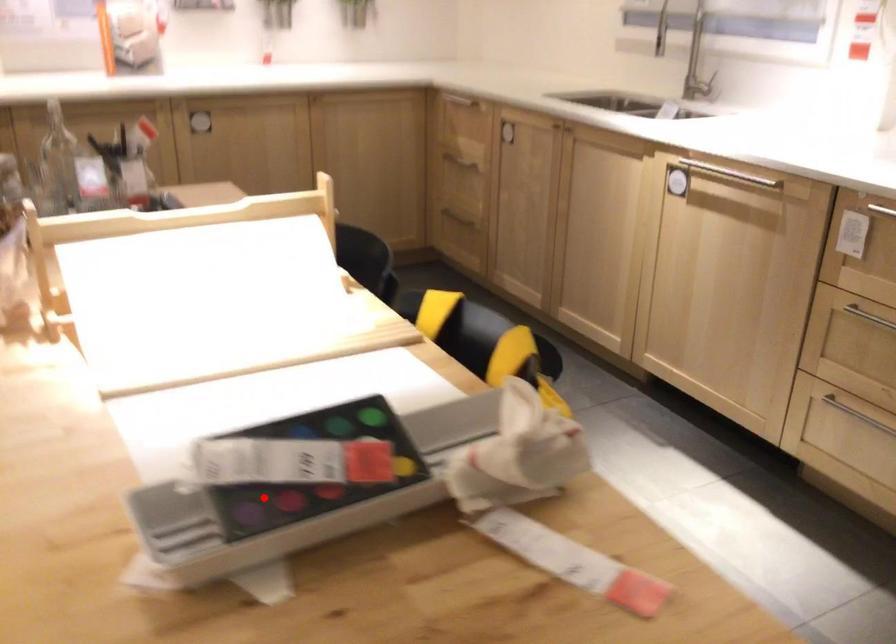
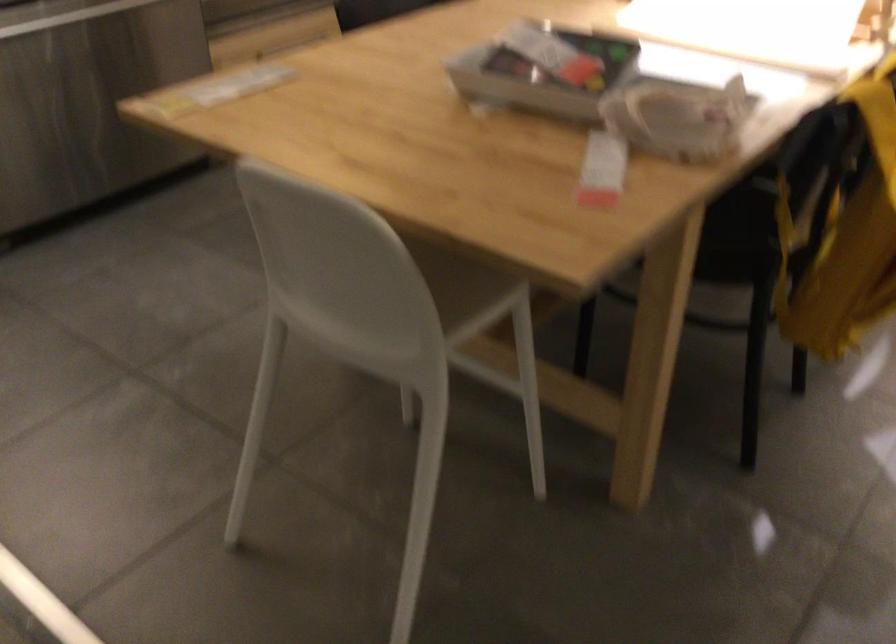
Question: I am providing you with two images of the same scene from different viewpoints. Given a red point in image1, look at the same physical point in image2. Is it:

Choices:
 (A) Closer to the viewpoint
 (B) Farther from the viewpoint

Answer: (B)